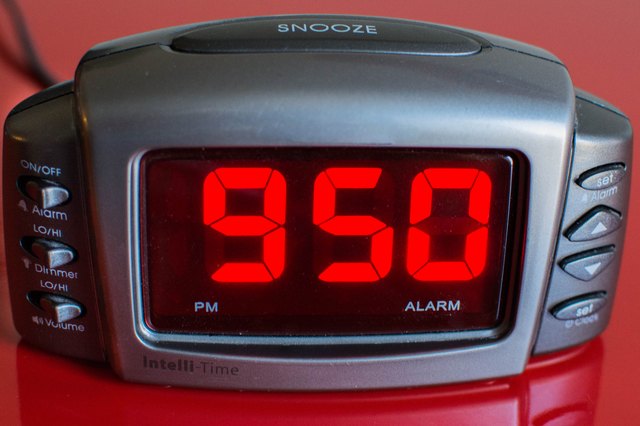
Locate an element on the screen. screen is located at coordinates (305, 311).